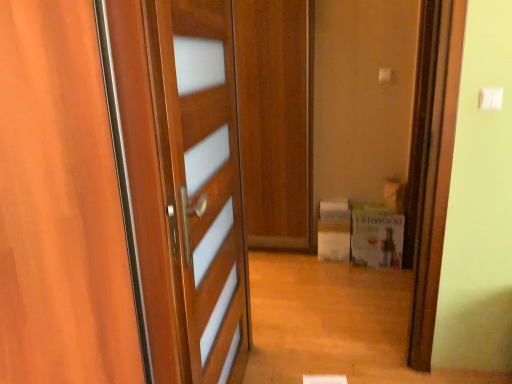
In the scene shown: In order to face wooden door at left, should I rotate leftwards or rightwards?

To face it directly, rotate left by 8.609 degrees.

The height and width of the screenshot is (384, 512). What do you see at coordinates (207, 182) in the screenshot?
I see `wooden door at left` at bounding box center [207, 182].

Identify the location of wooden door at left. The image size is (512, 384). (207, 182).

Locate an element on the screen. wooden door at left is located at coordinates (207, 182).